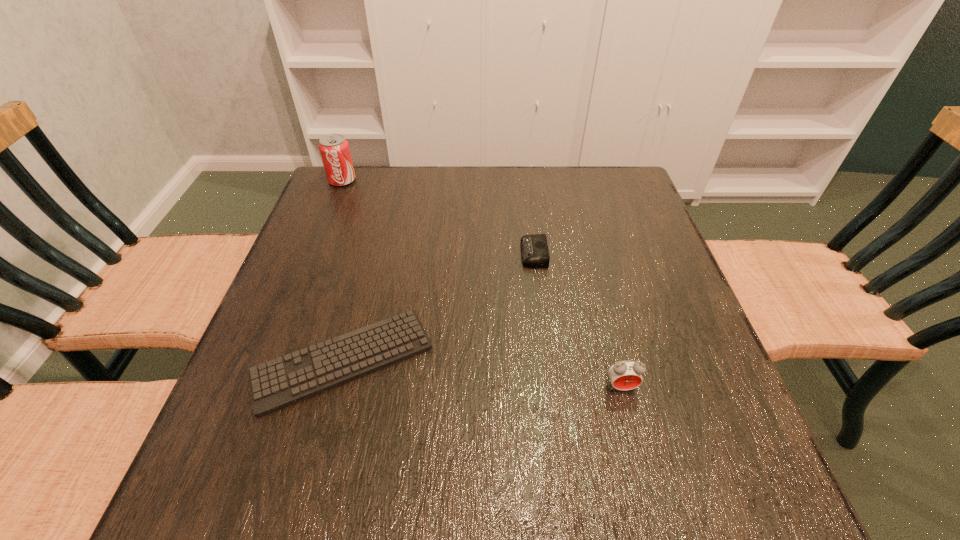
Find the location of a particular element. The width and height of the screenshot is (960, 540). soda can is located at coordinates (334, 149).

This screenshot has width=960, height=540. Identify the location of the farthest object. (334, 149).

Where is `the rightmost object`? The image size is (960, 540). the rightmost object is located at coordinates (625, 375).

You are a GUI agent. You are given a task and a screenshot of the screen. Output one action in this format:
    pyautogui.click(x=<x>, y=<y>)
    Task: Click on the right alarm clock
    This screenshot has width=960, height=540.
    Given the screenshot: What is the action you would take?
    pyautogui.click(x=625, y=375)

Identify the location of the third nearest object. The image size is (960, 540). (534, 248).

This screenshot has height=540, width=960. Find the location of `the farther alarm clock`. the farther alarm clock is located at coordinates (534, 248).

Locate an element on the screen. The image size is (960, 540). the shortest object is located at coordinates click(281, 382).

Where is `vacant space positioned on the right of the soda can`? This screenshot has height=540, width=960. vacant space positioned on the right of the soda can is located at coordinates (383, 180).

You are a GUI agent. You are given a task and a screenshot of the screen. Output one action in this format:
    pyautogui.click(x=<x>, y=<y>)
    Task: Click on the vacant point located on the face of the second tallest object
    The height and width of the screenshot is (540, 960).
    Given the screenshot: What is the action you would take?
    pyautogui.click(x=634, y=437)

This screenshot has height=540, width=960. Identify the location of free space located on the display of the second farthest object. (470, 254).